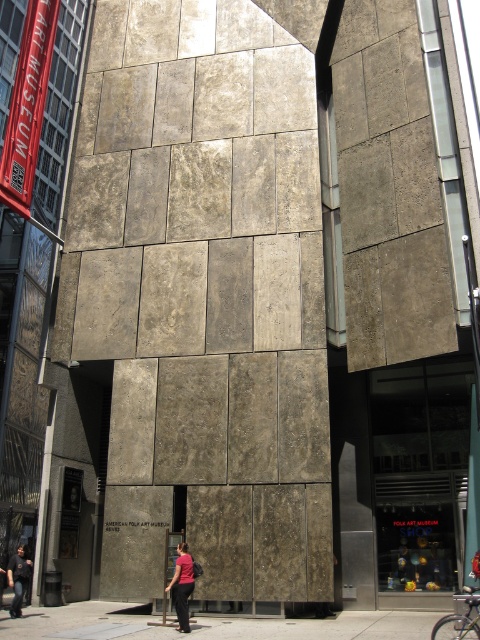
Is point (183, 586) positioned in front of point (21, 609)?

Yes, it is.

Looking at this image, is matte pink shirt at center to the right of dark gray concrete person at lower left from the viewer's perspective?

Yes, matte pink shirt at center is to the right of dark gray concrete person at lower left.

Who is more forward, (180, 582) or (23, 577)?

Positioned in front is point (180, 582).

At what (x,y) coordinates should I click in order to perform the action: click on matte pink shirt at center. Please return your answer as a coordinate pair (x, y). Looking at the image, I should click on (181, 586).